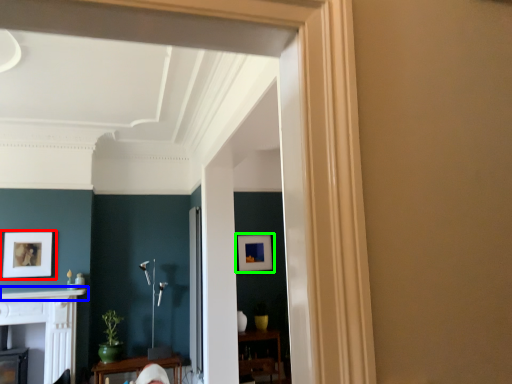
Question: Estimate the real-world distances between objects in this image. Which object is closer to picture frame (highlighted by a red box), mantle (highlighted by a blue box) or picture frame (highlighted by a green box)?

Choices:
 (A) mantle
 (B) picture frame

Answer: (A)